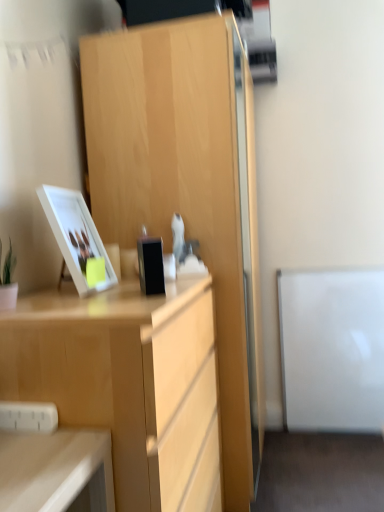
Question: Is black glossy phone at center shorter than white glossy picture frame at upper left?

Choices:
 (A) no
 (B) yes

Answer: (B)

Question: Would you consider black glossy phone at center to be distant from white glossy picture frame at upper left?

Choices:
 (A) yes
 (B) no

Answer: (B)

Question: Does black glossy phone at center lie in front of white glossy picture frame at upper left?

Choices:
 (A) no
 (B) yes

Answer: (B)

Question: From the image's perspective, is black glossy phone at center above white glossy picture frame at upper left?

Choices:
 (A) no
 (B) yes

Answer: (A)

Question: Considering the relative positions of black glossy phone at center and white glossy picture frame at upper left in the image provided, is black glossy phone at center to the left of white glossy picture frame at upper left from the viewer's perspective?

Choices:
 (A) no
 (B) yes

Answer: (A)

Question: Does black glossy phone at center have a greater width compared to white glossy picture frame at upper left?

Choices:
 (A) yes
 (B) no

Answer: (B)

Question: From the image's perspective, does black glossy phone at center appear lower than light wood desk at center?

Choices:
 (A) yes
 (B) no

Answer: (B)

Question: Considering the relative positions of black glossy phone at center and light wood desk at center in the image provided, is black glossy phone at center to the left of light wood desk at center from the viewer's perspective?

Choices:
 (A) no
 (B) yes

Answer: (A)

Question: From the image's perspective, is black glossy phone at center above light wood desk at center?

Choices:
 (A) no
 (B) yes

Answer: (B)

Question: Is black glossy phone at center oriented towards light wood desk at center?

Choices:
 (A) no
 (B) yes

Answer: (A)

Question: Can we say black glossy phone at center lies outside light wood desk at center?

Choices:
 (A) no
 (B) yes

Answer: (B)

Question: Does black glossy phone at center lie behind light wood desk at center?

Choices:
 (A) yes
 (B) no

Answer: (A)

Question: Does light wood desk at center contain light wood cabinet at center?

Choices:
 (A) yes
 (B) no

Answer: (B)